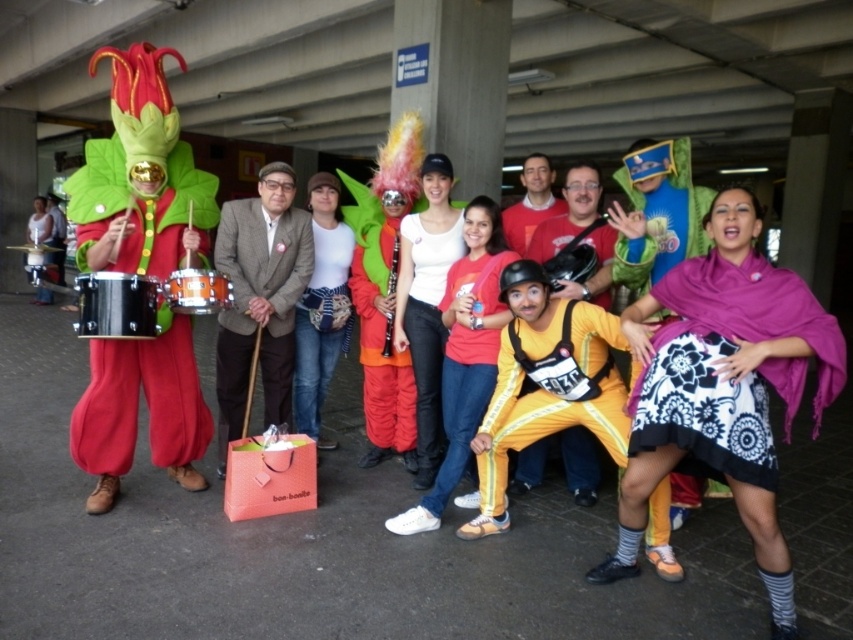
Who is positioned more to the right, yellow matte costume at center or metallic drum at left?

yellow matte costume at center

Which of these two, yellow matte costume at center or metallic drum at left, stands shorter?

yellow matte costume at center

At what (x,y) coordinates should I click in order to perform the action: click on yellow matte costume at center. Please return your answer as a coordinate pair (x, y). This screenshot has width=853, height=640. Looking at the image, I should click on (578, 234).

In order to click on yellow matte costume at center in this screenshot , I will do `click(578, 234)`.

Does floral-patterned skirt at center have a greater height compared to matte green costume at left?

No.

I want to click on floral-patterned skirt at center, so click(723, 387).

Is orange fabric clarinet at center shorter than black plastic clarinet at center?

In fact, orange fabric clarinet at center may be taller than black plastic clarinet at center.

I want to click on orange fabric clarinet at center, so click(381, 365).